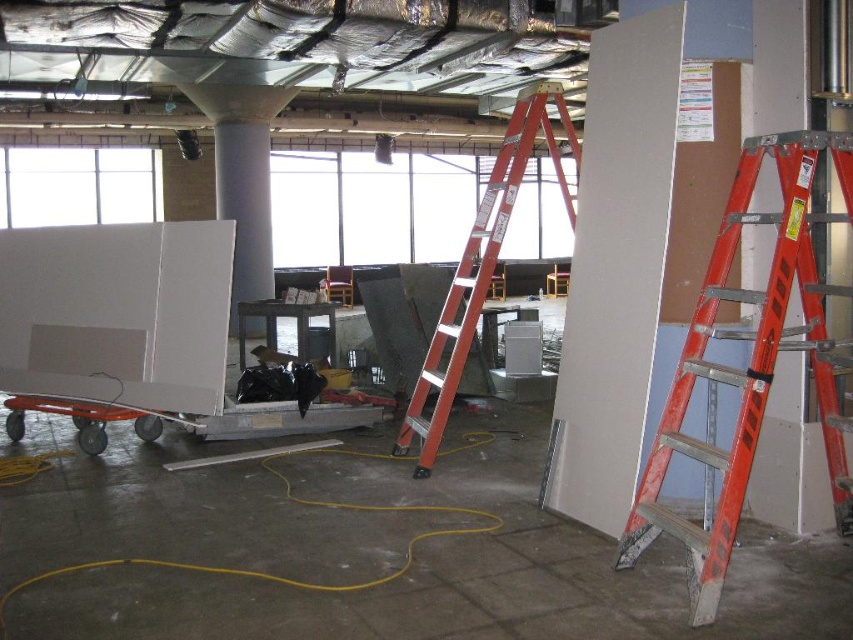
You are a worker in the construction site. You need to move a heavy tool from the smooth white pillar at right to the orange metallic ladder at center. Which object should you place the tool closer to first?

The smooth white pillar at right is closer to the viewer than the orange metallic ladder at center, so you should place the tool closer to the smooth white pillar at right first.

You are a worker in the construction site. You need to move the orange metallic ladder at right and the smooth white pillar at right to a different location. Which object should you move first if you want to move them in the order from left to right as seen from your current position?

You should move the orange metallic ladder at right first because it is positioned to the left of the smooth white pillar at right, so moving them from left to right would start with the orange metallic ladder at right.

You are a delivery person with a box that is 2 meters long. You need to move it through the space between the smooth white pillar at right and the orange metallic ladder at center. Can you fit the box through that space?

The space between the smooth white pillar at right and the orange metallic ladder at center is 1.86 meters. Since the box is 2 meters long, it is longer than the available space, so the box cannot fit through that space.